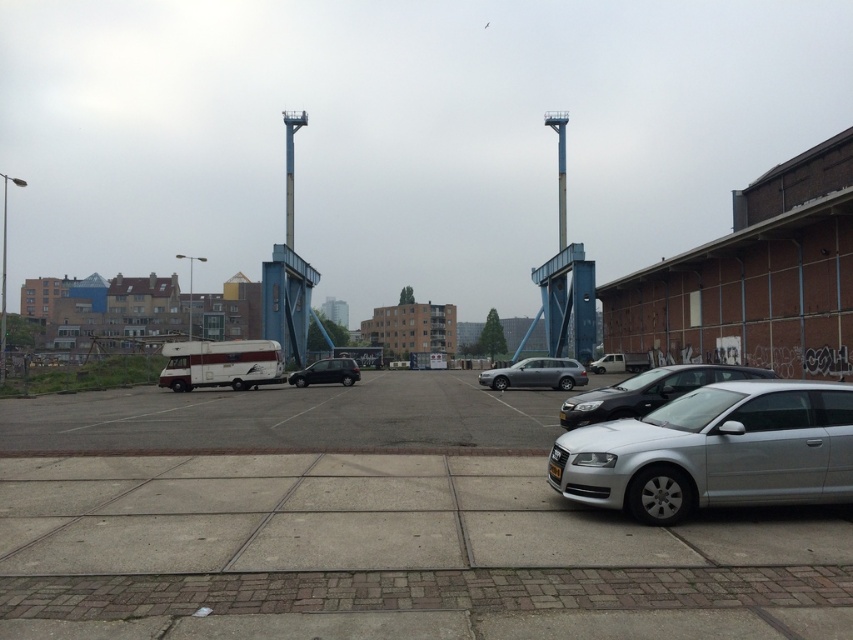
You are a delivery driver who needs to park your truck in the parking lot. Your truck requires a space that is at least 100 feet away from any other vehicle. Looking at the scene, can you park between the silver metallic car at lower right and the satin silver sedan at center?

The silver metallic car at lower right and the satin silver sedan at center are 89.66 feet apart from each other. Since the required distance is 100 feet, the space between them is insufficient. Therefore, you cannot park there.

You are a delivery person trying to unload a package from the trunk of your vehicle. You see the satin silver sedan at center and the satin black van at center. Which vehicle should you move first to access the trunk without blocking the other?

You should move the satin silver sedan at center first because it is in front of the satin black van at center, so moving it would allow access to the trunk without blocking the van.